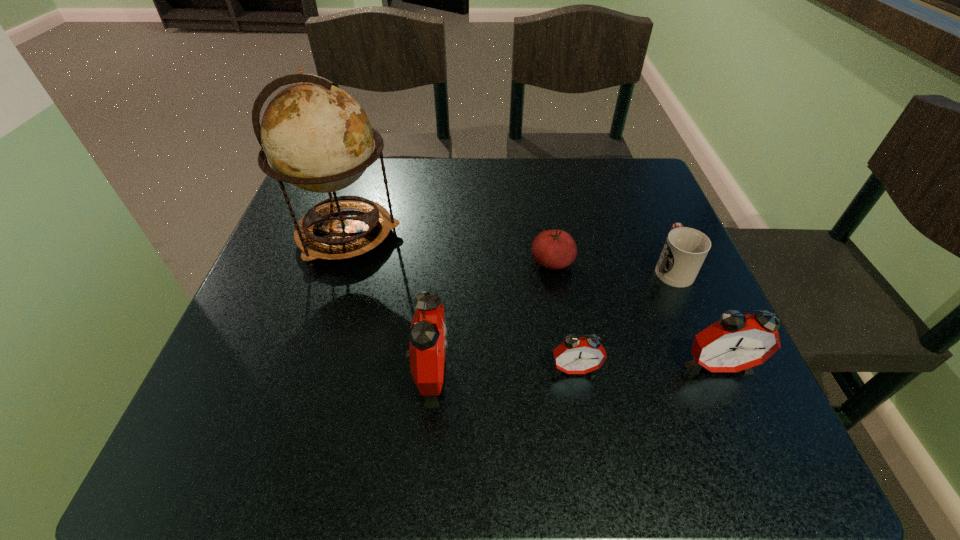
Locate an element on the screen. vacant place for an extra alarm clock on the left is located at coordinates (283, 377).